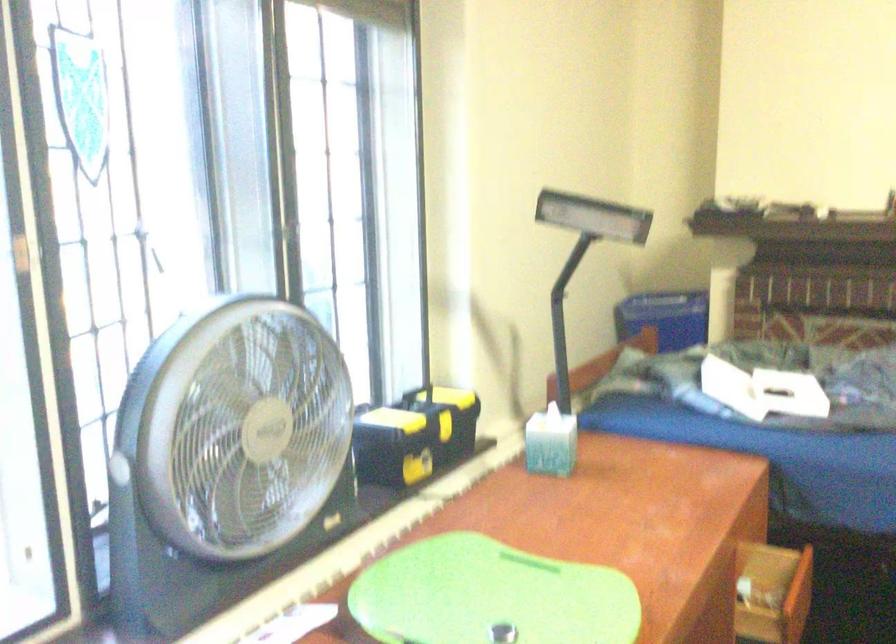
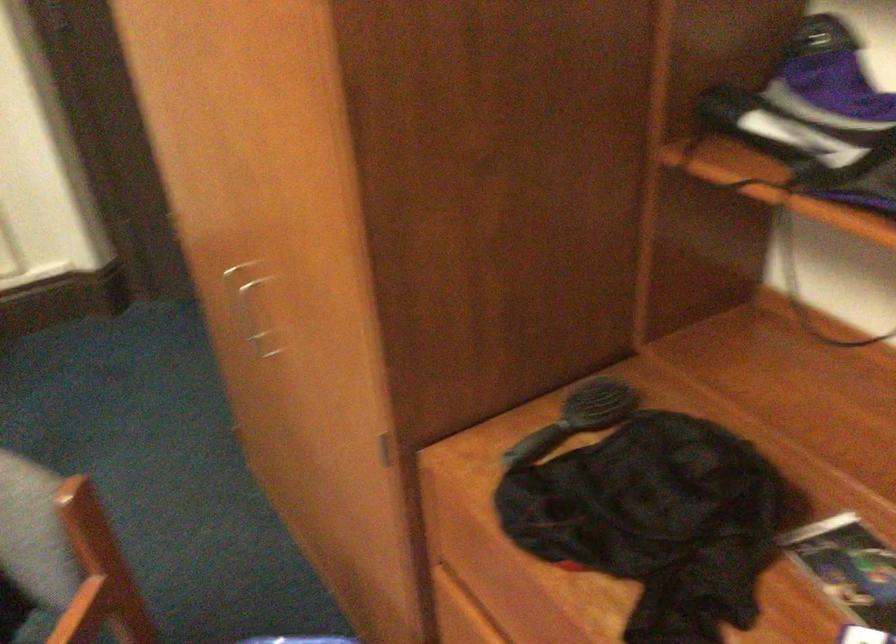
Consider the image. First-person continuous shooting, in which direction is the camera rotating?

The rotation direction of the camera is right-down.